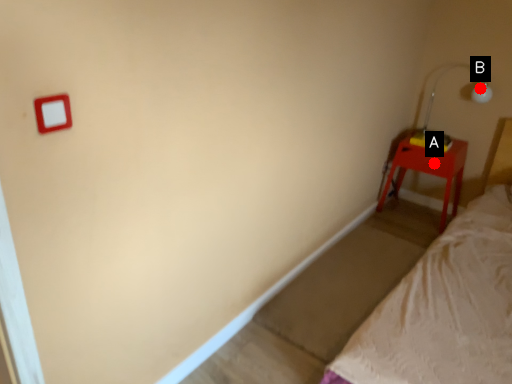
Question: Two points are circled on the image, labeled by A and B beside each circle. Which point is farther from the camera taking this photo?

Choices:
 (A) A is further
 (B) B is further

Answer: (B)